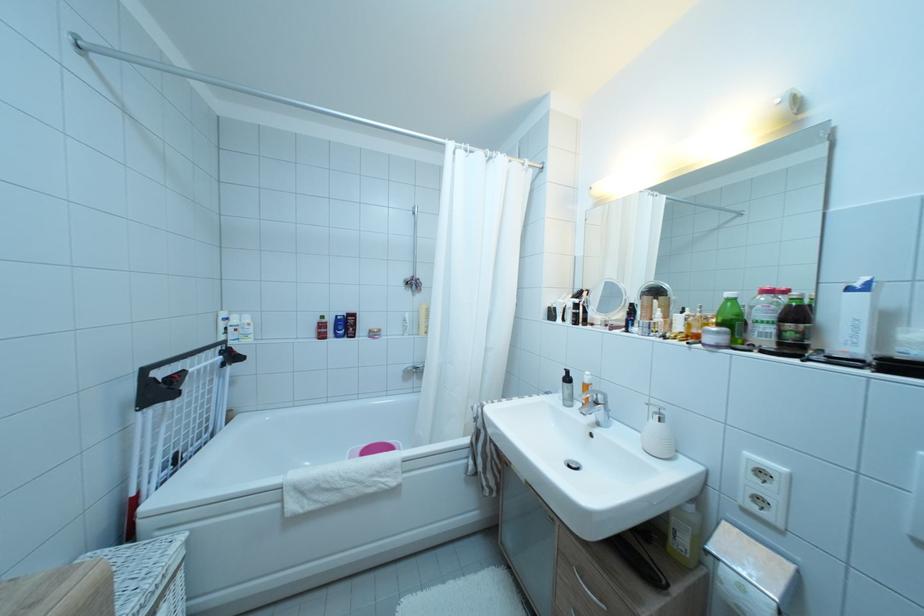
What are the coordinates of `white dispenser pump` in the screenshot? It's located at coord(658,434).